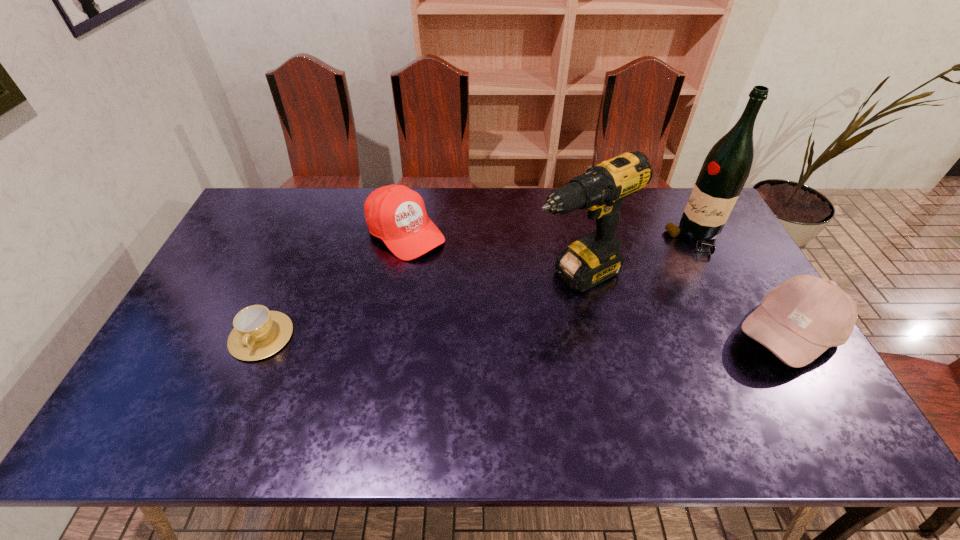
Locate which object is the third closest to the farther baseball cap. Please provide its 2D coordinates. Your answer should be formatted as a tuple, i.e. [(x, y)], where the tuple contains the x and y coordinates of a point satisfying the conditions above.

[(726, 168)]